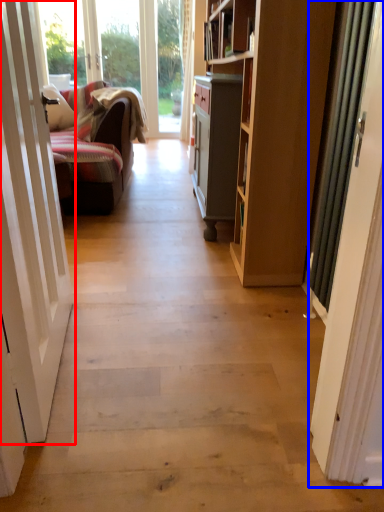
Question: Which point is further to the camera, door (highlighted by a red box) or door (highlighted by a blue box)?

Choices:
 (A) door
 (B) door

Answer: (B)